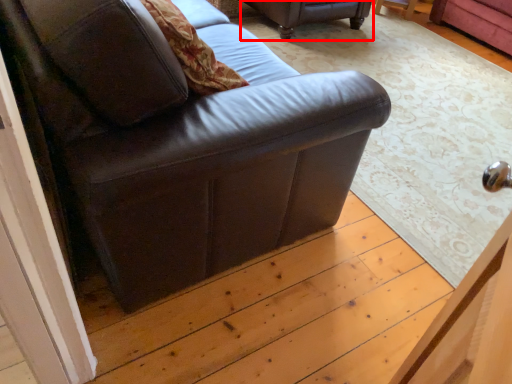
Question: Observing the image, what is the correct spatial positioning of studio couch (annotated by the red box) in reference to studio couch?

Choices:
 (A) right
 (B) left

Answer: (A)